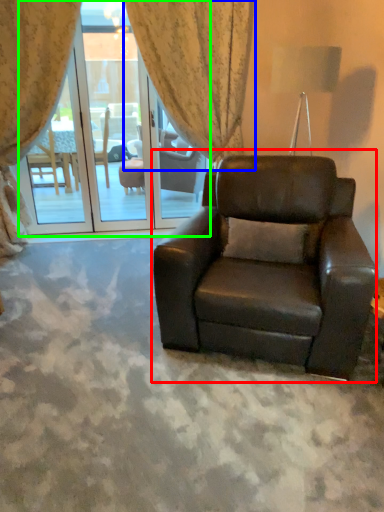
Question: Which object is positioned farthest from chair (highlighted by a red box)? Select from curtain (highlighted by a blue box) and screen door (highlighted by a green box).

Choices:
 (A) curtain
 (B) screen door

Answer: (B)